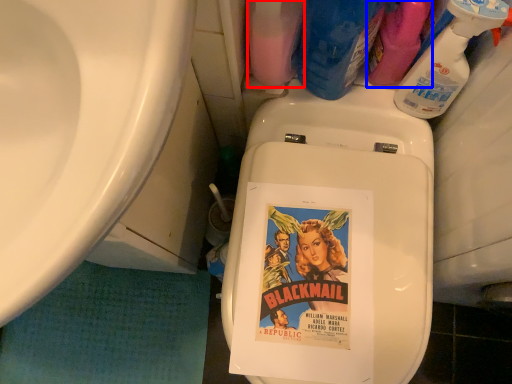
Question: Which of the following is the closest to the observer, cleaning product (highlighted by a red box) or cleaning product (highlighted by a blue box)?

Choices:
 (A) cleaning product
 (B) cleaning product

Answer: (A)